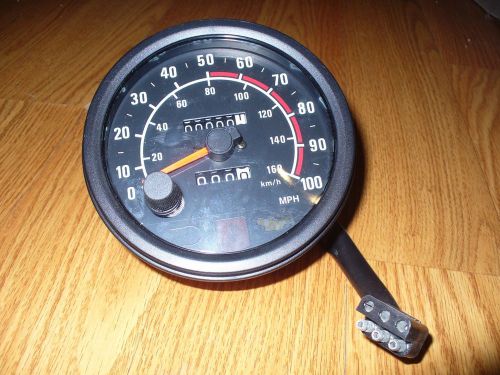
Locate an element on the screen. wooden floor is located at coordinates (402, 135).